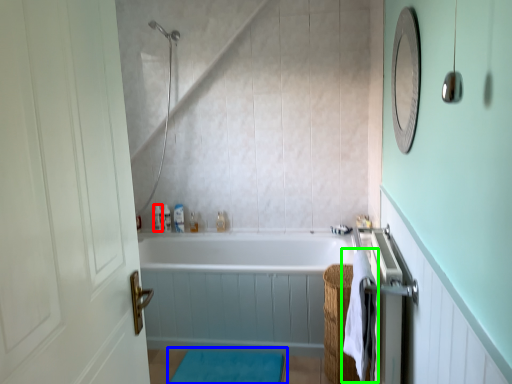
Question: Based on their relative distances, which object is nearer to toiletry (highlighted by a red box)? Choose from bath mat (highlighted by a blue box) and beach towel (highlighted by a green box).

Choices:
 (A) bath mat
 (B) beach towel

Answer: (A)